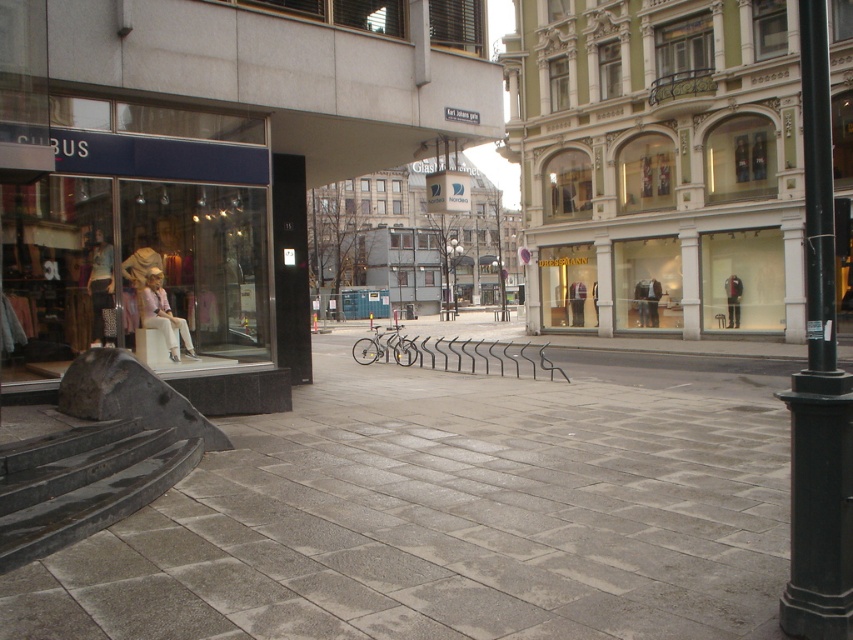
Consider the image. Is matte glass storefront at center positioned in front of wooden park bench at center?

Yes, it is in front of wooden park bench at center.

Can you confirm if matte glass storefront at center is thinner than wooden park bench at center?

In fact, matte glass storefront at center might be wider than wooden park bench at center.

Where is `matte glass storefront at center`? The width and height of the screenshot is (853, 640). matte glass storefront at center is located at coordinates (659, 163).

Is gray concrete pavement at center above black metal pole at center?

Actually, gray concrete pavement at center is below black metal pole at center.

Who is more forward, (463, 381) or (503, 298)?

Point (463, 381) is in front.

The width and height of the screenshot is (853, 640). I want to click on gray concrete pavement at center, so click(456, 512).

Measure the distance from gray concrete pavement at center to matte glass storefront at center.

They are 11.21 meters apart.

Which is more to the left, gray concrete pavement at center or matte glass storefront at center?

Positioned to the left is gray concrete pavement at center.

Does point (231, 564) come farther from viewer compared to point (534, 180)?

No, (231, 564) is closer to viewer.

Find the location of a particular element. gray concrete pavement at center is located at coordinates coord(456,512).